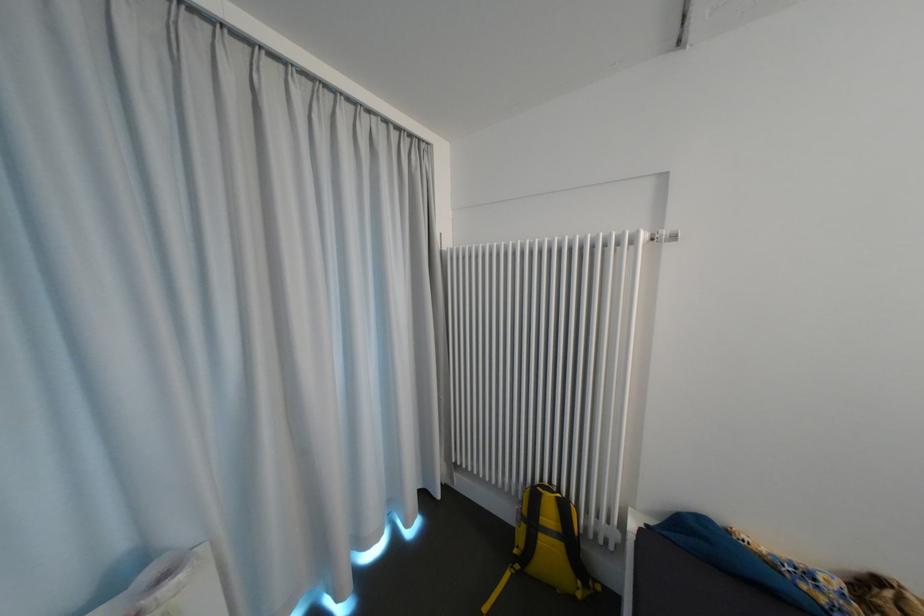
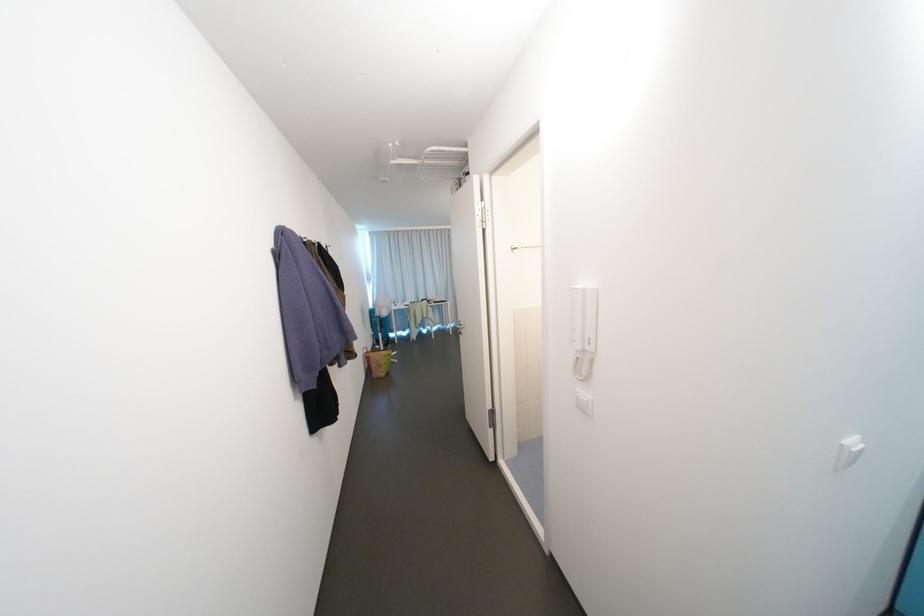
Question: I am providing you with two images of the same scene from different viewpoints. Which of the following objects are not visible in image2?

Choices:
 (A) silver towel rack
 (B) drying rack bar
 (C) green pen cap
 (D) yellow backpack

Answer: (D)